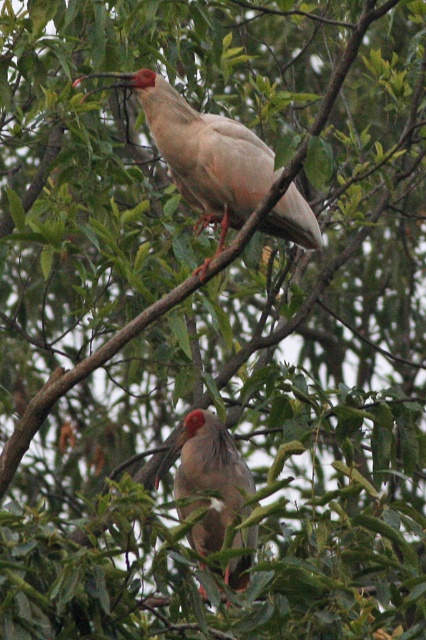
You are a birdwatcher trying to identify which bird is closer to the top of the tree. You see the matte white bird at upper center and the matte gray bird at center. Which bird is positioned higher up?

The matte white bird at upper center is positioned higher up than the matte gray bird at center.

From the picture: You are a birdwatcher observing the two birds in the tree. Which bird is positioned higher up in the tree, the matte white bird at upper center or the matte gray bird at center?

The matte white bird at upper center is positioned higher up in the tree than the matte gray bird at center.